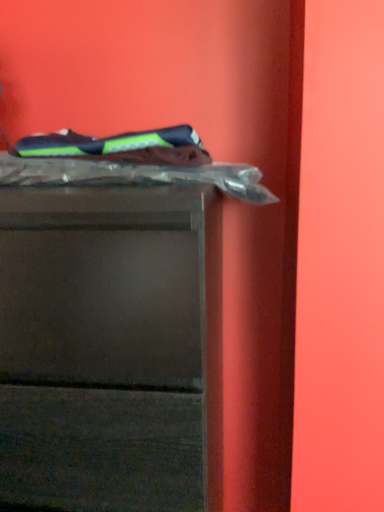
Question: Does matte plastic chest of drawers at upper left have a lesser width compared to dark blue fabric at upper left, which is the 1th laundry from top to bottom?

Choices:
 (A) yes
 (B) no

Answer: (B)

Question: Considering the relative sizes of matte plastic chest of drawers at upper left and dark blue fabric at upper left, which is the 1th laundry from top to bottom, in the image provided, is matte plastic chest of drawers at upper left wider than dark blue fabric at upper left, which is the 1th laundry from top to bottom,?

Choices:
 (A) yes
 (B) no

Answer: (A)

Question: Does matte plastic chest of drawers at upper left have a lesser height compared to dark blue fabric at upper left, the 2th laundry positioned from the bottom?

Choices:
 (A) yes
 (B) no

Answer: (B)

Question: Can you confirm if matte plastic chest of drawers at upper left is positioned to the left of dark blue fabric at upper left, the 2th laundry positioned from the bottom?

Choices:
 (A) yes
 (B) no

Answer: (A)

Question: From a real-world perspective, is matte plastic chest of drawers at upper left physically below dark blue fabric at upper left, the 2th laundry positioned from the bottom?

Choices:
 (A) yes
 (B) no

Answer: (A)

Question: Considering their positions, is matte plastic chest of drawers at upper left located in front of or behind dark blue fabric at upper left, the 2th laundry positioned from the bottom?

Choices:
 (A) front
 (B) behind

Answer: (A)

Question: Considering the relative positions of matte plastic chest of drawers at upper left and dark blue fabric at upper left, which is the 1th laundry from top to bottom, in the image provided, is matte plastic chest of drawers at upper left to the left or to the right of dark blue fabric at upper left, which is the 1th laundry from top to bottom,?

Choices:
 (A) left
 (B) right

Answer: (A)

Question: From their relative heights in the image, would you say matte plastic chest of drawers at upper left is taller or shorter than dark blue fabric at upper left, the 2th laundry positioned from the bottom?

Choices:
 (A) short
 (B) tall

Answer: (B)

Question: Considering the positions of matte plastic chest of drawers at upper left and dark blue fabric at upper left, the 2th laundry positioned from the bottom, in the image, is matte plastic chest of drawers at upper left wider or thinner than dark blue fabric at upper left, the 2th laundry positioned from the bottom,?

Choices:
 (A) wide
 (B) thin

Answer: (A)

Question: Is clear plastic laundry at upper center, the 2th laundry from the top, inside or outside of dark blue fabric at upper left, which is the 1th laundry from top to bottom?

Choices:
 (A) outside
 (B) inside

Answer: (A)

Question: Would you say clear plastic laundry at upper center, the 2th laundry from the top, is to the left or to the right of dark blue fabric at upper left, which is the 1th laundry from top to bottom, in the picture?

Choices:
 (A) right
 (B) left

Answer: (A)

Question: Considering the positions of point (177, 134) and point (195, 143), is point (177, 134) closer or farther from the camera than point (195, 143)?

Choices:
 (A) farther
 (B) closer

Answer: (B)

Question: Is clear plastic laundry at upper center, the 2th laundry from the top, taller or shorter than dark blue fabric at upper left, which is the 1th laundry from top to bottom?

Choices:
 (A) short
 (B) tall

Answer: (A)

Question: Based on their sizes in the image, would you say dark blue fabric at upper left, the 2th laundry positioned from the bottom, is bigger or smaller than clear plastic laundry at upper center, the 2th laundry from the top?

Choices:
 (A) small
 (B) big

Answer: (A)

Question: From their relative heights in the image, would you say dark blue fabric at upper left, the 2th laundry positioned from the bottom, is taller or shorter than clear plastic laundry at upper center, the 2th laundry from the top?

Choices:
 (A) short
 (B) tall

Answer: (B)